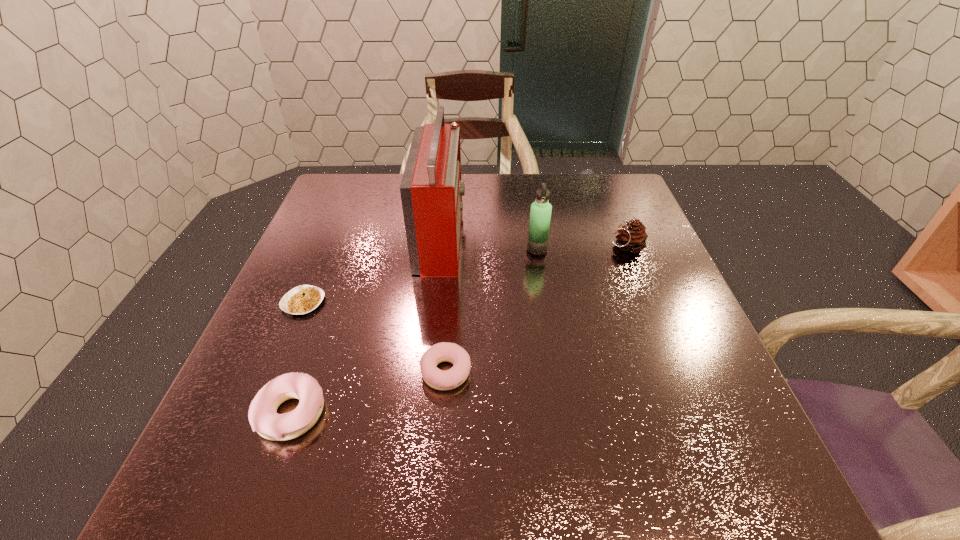
Locate an element on the screen. This screenshot has width=960, height=540. object that is the third closest to the tallest object is located at coordinates (438, 379).

You are a GUI agent. You are given a task and a screenshot of the screen. Output one action in this format:
    pyautogui.click(x=<x>, y=<y>)
    Task: Click on the free location that satisfies the following two spatial constraints: 1. on the back side of the second object from right to left; 2. on the front-facing side of the radio receiver
    
    Given the screenshot: What is the action you would take?
    pyautogui.click(x=535, y=236)

Image resolution: width=960 pixels, height=540 pixels. In order to click on vacant space that satisfies the following two spatial constraints: 1. on the front-facing side of the second object from right to left; 2. on the right side of the radio receiver in this screenshot , I will do `click(440, 249)`.

At what (x,y) coordinates should I click in order to perform the action: click on vacant point that satisfies the following two spatial constraints: 1. on the front side of the shortest object; 2. on the left side of the third shortest object. Please return your answer as a coordinate pair (x, y). This screenshot has height=540, width=960. Looking at the image, I should click on [257, 413].